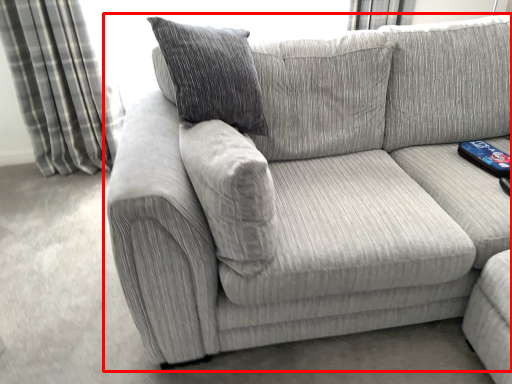
Question: From the image's perspective, what is the correct spatial positioning of studio couch (annotated by the red box) in reference to curtain?

Choices:
 (A) above
 (B) below

Answer: (B)